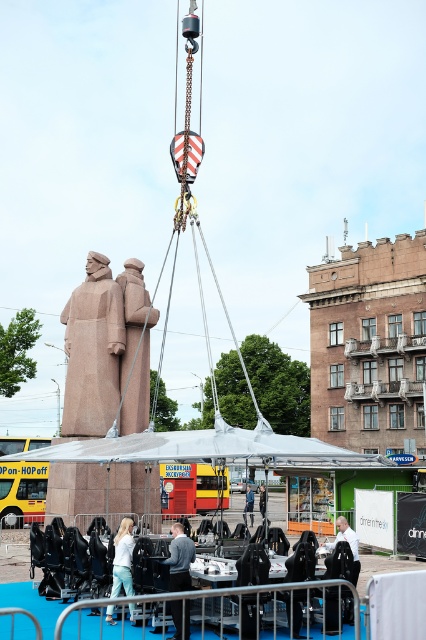
Is point (124, 369) less distant than point (253, 508)?

Yes, point (124, 369) is in front of point (253, 508).

Can you confirm if brown granite statue at center is positioned below blue fabric jacket at center?

Incorrect, brown granite statue at center is not positioned below blue fabric jacket at center.

Is point (143, 403) behind point (249, 499)?

No, (143, 403) is closer to viewer.

Locate an element on the screen. This screenshot has width=426, height=640. brown granite statue at center is located at coordinates (135, 348).

Which is above, light blue jeans at lower left or blue fabric jacket at center?

light blue jeans at lower left

Is light blue jeans at lower left in front of blue fabric jacket at center?

Yes, it is in front of blue fabric jacket at center.

Which is behind, point (131, 540) or point (245, 506)?

Point (245, 506)

The width and height of the screenshot is (426, 640). I want to click on light blue jeans at lower left, so click(x=123, y=557).

Can you confirm if light blue jeans at lower left is positioned to the right of dark gray suit at center?

In fact, light blue jeans at lower left is to the left of dark gray suit at center.

Based on the photo, who is positioned more to the right, light blue jeans at lower left or dark gray suit at center?

Positioned to the right is dark gray suit at center.

Which is in front, point (129, 531) or point (265, 499)?

Point (129, 531)

At what (x,y) coordinates should I click in order to perform the action: click on light blue jeans at lower left. Please return your answer as a coordinate pair (x, y). The image size is (426, 640). Looking at the image, I should click on (123, 557).